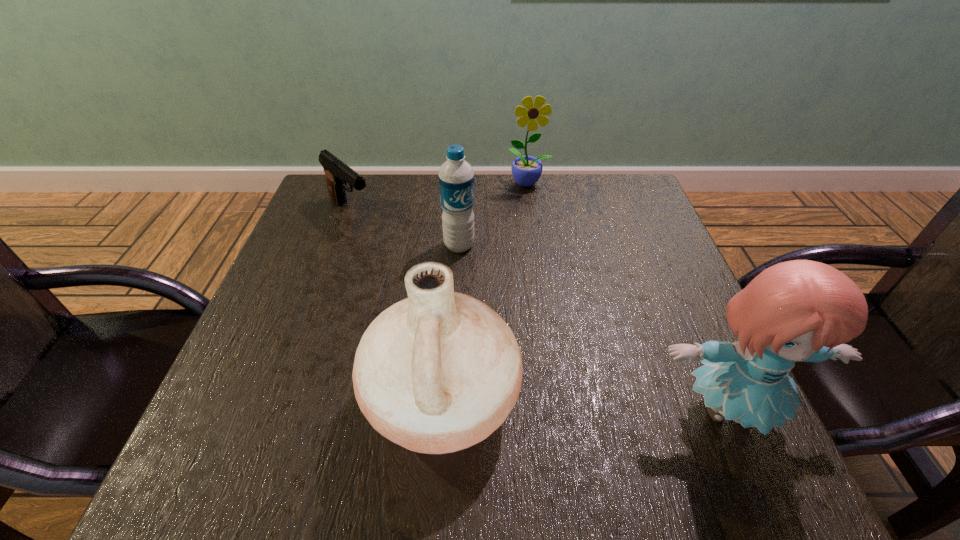
Identify the location of pottery. click(x=437, y=372).

Locate an element on the screen. The image size is (960, 540). doll is located at coordinates (796, 311).

Where is `the third nearest object`? the third nearest object is located at coordinates (456, 176).

Where is `pistol`? pistol is located at coordinates (337, 173).

At what (x,y) coordinates should I click in order to perform the action: click on the leftmost object. Please return your answer as a coordinate pair (x, y). Looking at the image, I should click on (337, 173).

The width and height of the screenshot is (960, 540). I want to click on the farthest object, so click(x=526, y=170).

At what (x,y) coordinates should I click in order to perform the action: click on sunflower. Please return your answer as a coordinate pair (x, y). The image size is (960, 540). Looking at the image, I should click on (526, 170).

The height and width of the screenshot is (540, 960). What are the coordinates of `free location located to pour from the handle of the pottery` in the screenshot? It's located at (290, 401).

Locate an element on the screen. The width and height of the screenshot is (960, 540). vacant region located 0.130m to pour from the handle of the pottery is located at coordinates (290, 401).

Where is `vacant point located to pour from the handle of the pottery`? vacant point located to pour from the handle of the pottery is located at coordinates (243, 401).